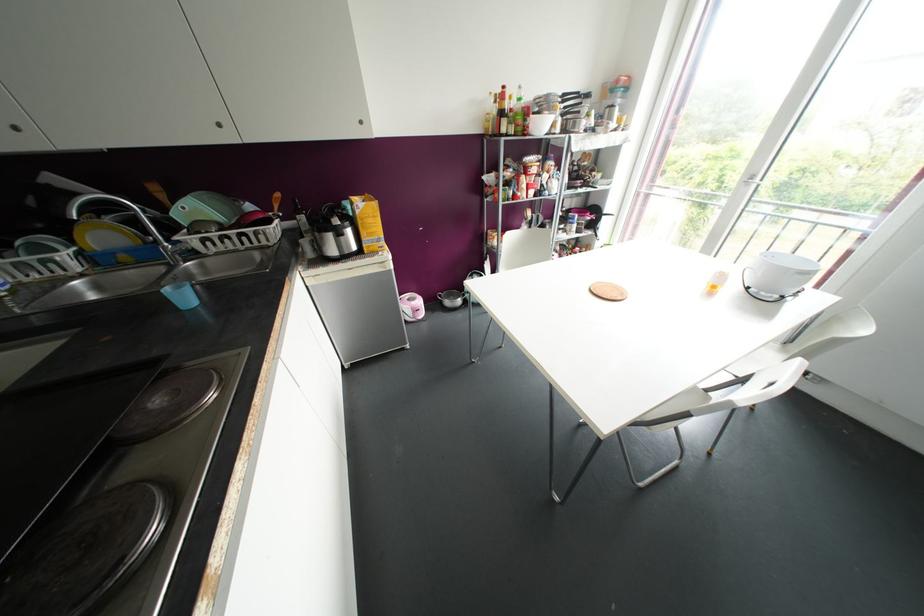
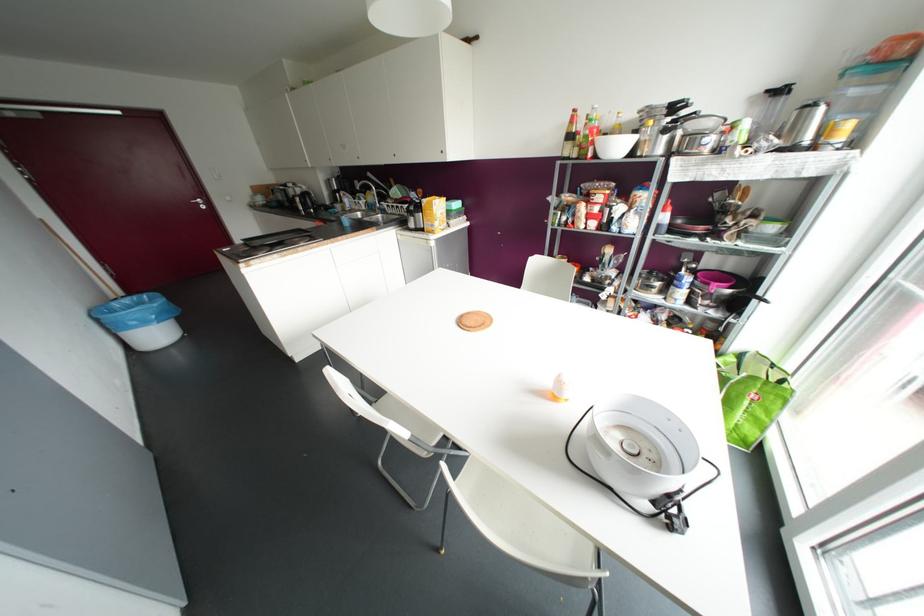
Locate, in the second image, the point that corresponds to point 503,86 in the first image.

(574, 110)